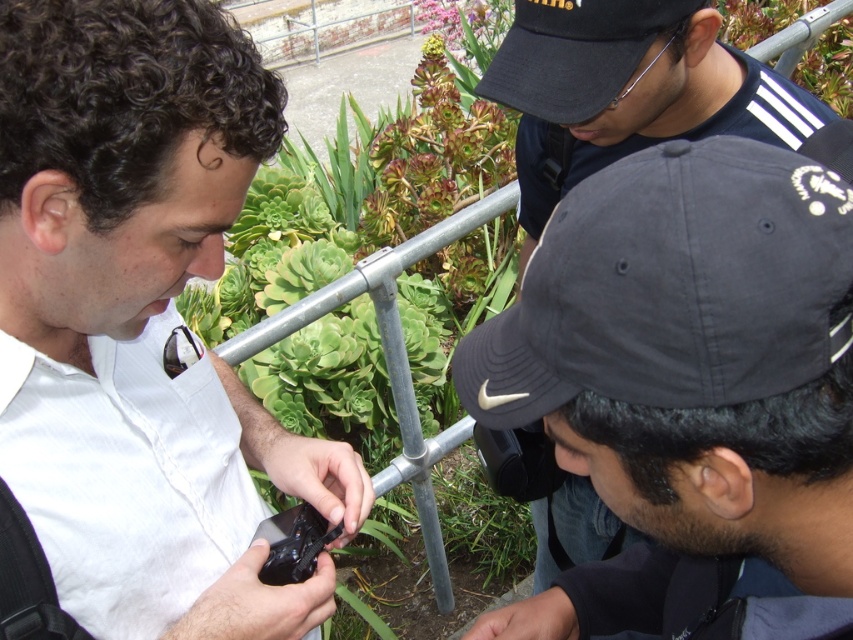
Question: Can you confirm if dark gray cap at center is positioned above dark gray fabric baseball cap at center?

Choices:
 (A) no
 (B) yes

Answer: (A)

Question: Is dark gray cap at center to the right of black matte baseball cap at upper right from the viewer's perspective?

Choices:
 (A) yes
 (B) no

Answer: (B)

Question: Does green succulent at center have a greater width compared to black glossy smartphone at center?

Choices:
 (A) yes
 (B) no

Answer: (A)

Question: Which point appears farthest from the camera in this image?

Choices:
 (A) (315, 536)
 (B) (827, 220)
 (C) (381, 257)
 (D) (461, 353)

Answer: (C)

Question: Among these points, which one is farthest from the camera?

Choices:
 (A) (183, 429)
 (B) (790, 339)

Answer: (A)

Question: Which point appears closest to the camera in this image?

Choices:
 (A) (190, 189)
 (B) (679, 275)
 (C) (688, 314)
 (D) (268, 577)

Answer: (B)